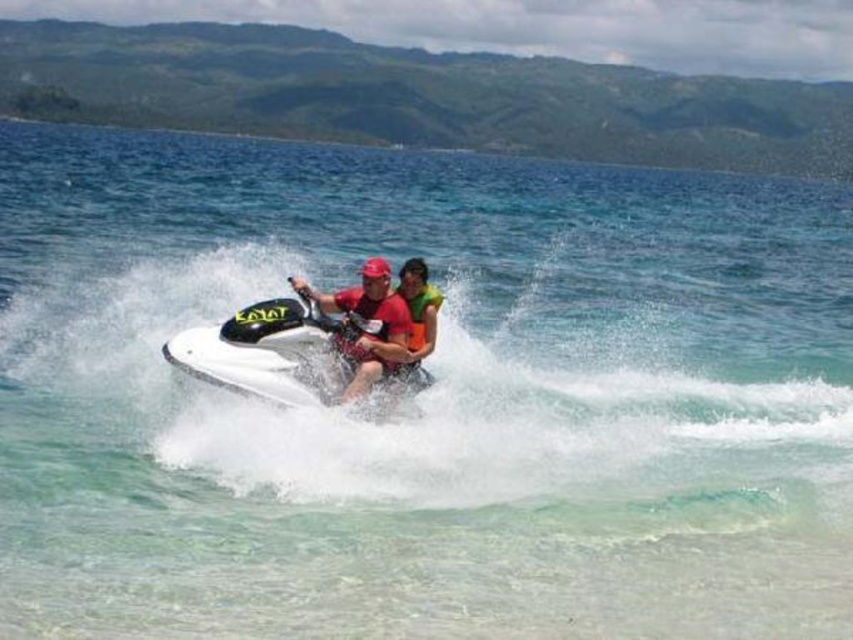
You are a photographer trying to capture a clear photo of the matte red shirt at center and the white glossy jet ski at center. Since the jet ski is moving, you need to know which one is wider to adjust your camera settings. Which object is wider?

The white glossy jet ski at center is wider than the matte red shirt at center.

You are a photographer standing on a boat 15 meters away from the jet ski. You want to take a photo of the matte red shirt at center. Is the distance within your camera lens range if the maximum focus distance is 15 meters?

The matte red shirt at center is 15.26 meters away from the camera, which exceeds the maximum focus distance of 15 meters. Therefore, the camera cannot focus on the matte red shirt at center.